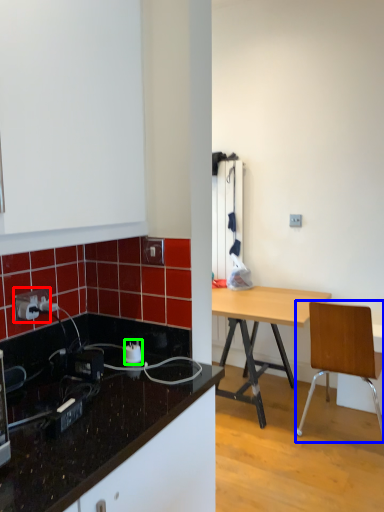
Question: Which object is positioned closest to power outlet (highlighted by a red box)? Select from chair (highlighted by a blue box) and power plugs and sockets (highlighted by a green box).

Choices:
 (A) chair
 (B) power plugs and sockets

Answer: (B)